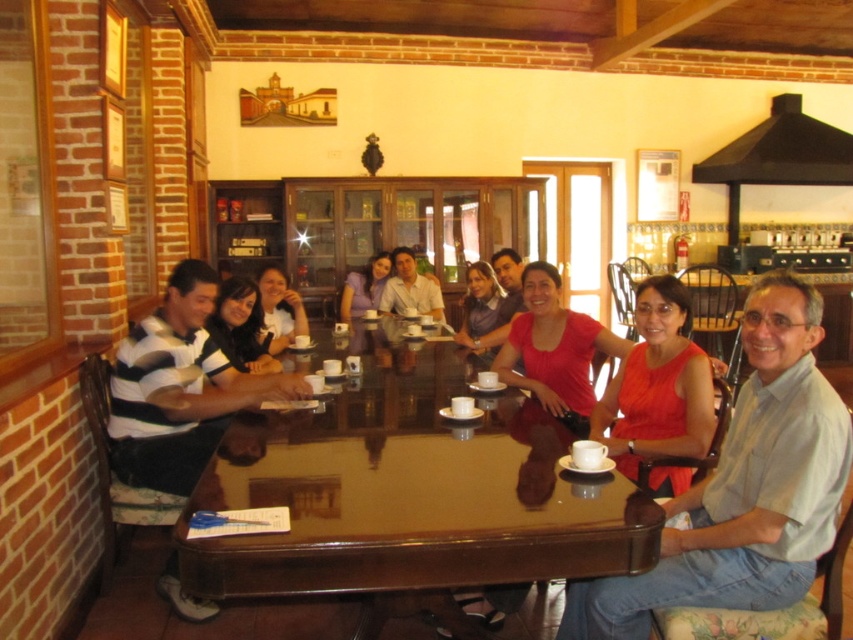
Question: Among these objects, which one is farthest from the camera?

Choices:
 (A) matte black shirt at center
 (B) purple matte shirt at center
 (C) white matte shirt at center

Answer: (B)

Question: Is the position of matte black shirt at center less distant than that of white matte shirt at center?

Choices:
 (A) no
 (B) yes

Answer: (B)

Question: Which is farther from the light blue cotton shirt at center?

Choices:
 (A) matte white shirt at center
 (B) matte purple shirt at center
 (C) matte black shirt at center

Answer: (A)

Question: Which of these objects is positioned closest to the matte red dress at center?

Choices:
 (A) matte purple shirt at center
 (B) white matte shirt at center
 (C) light blue cotton shirt at center
 (D) matte white shirt at center

Answer: (C)

Question: Does matte black shirt at center have a larger size compared to white matte shirt at center?

Choices:
 (A) yes
 (B) no

Answer: (A)

Question: Is matte red dress at center bigger than matte white shirt at center?

Choices:
 (A) no
 (B) yes

Answer: (A)